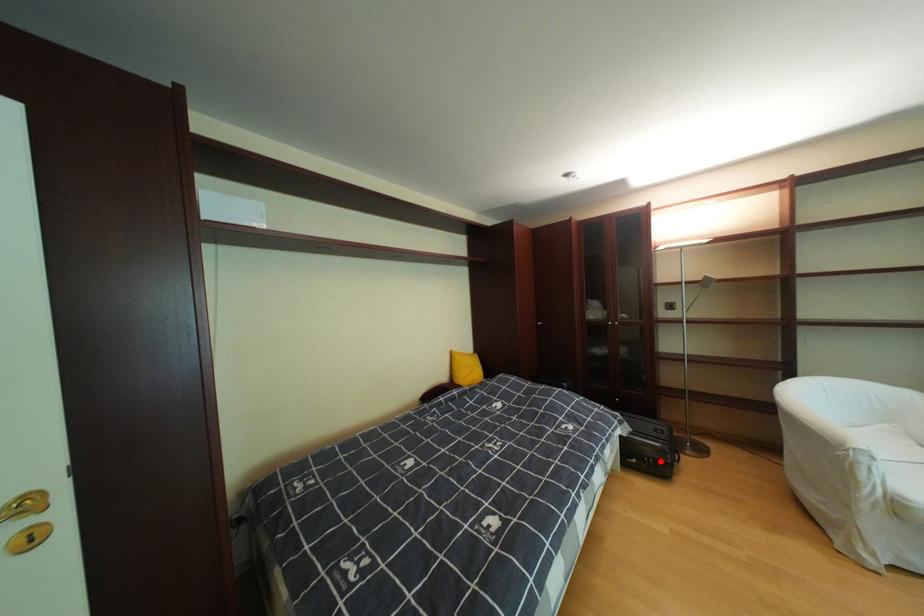
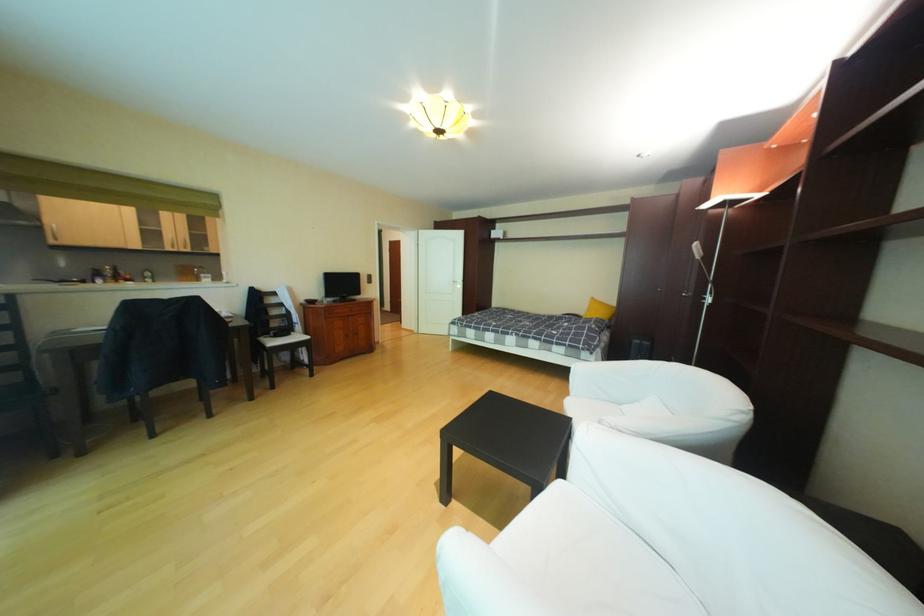
Question: I am providing you with two images of the same scene from different viewpoints. A red point is marked on the first image. At the location where the point appears in image 1, is it still visible in image 2?

Choices:
 (A) Yes
 (B) No

Answer: (B)